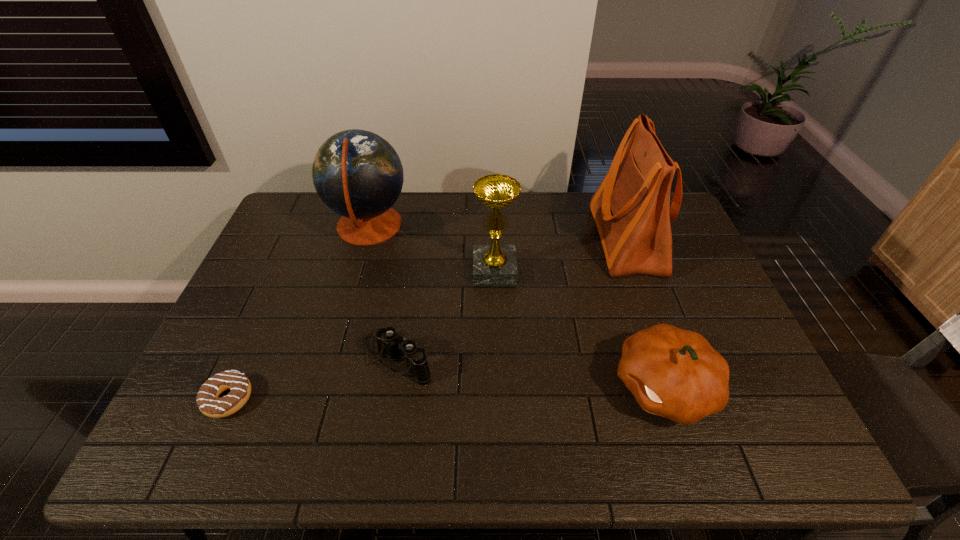
Where is `the fifth closest object to the leftmost object`? The width and height of the screenshot is (960, 540). the fifth closest object to the leftmost object is located at coordinates (631, 208).

Identify the location of object identified as the fifth closest to the binoculars. (631, 208).

Where is `vacant area that satisfies the following two spatial constraints: 1. on the front pocket of the shopping bag; 2. on the front-facing side of the award`? The width and height of the screenshot is (960, 540). vacant area that satisfies the following two spatial constraints: 1. on the front pocket of the shopping bag; 2. on the front-facing side of the award is located at coordinates (636, 269).

Locate an element on the screen. Image resolution: width=960 pixels, height=540 pixels. vacant area that satisfies the following two spatial constraints: 1. on the front face of the third shortest object; 2. on the front side of the shortest object is located at coordinates (667, 399).